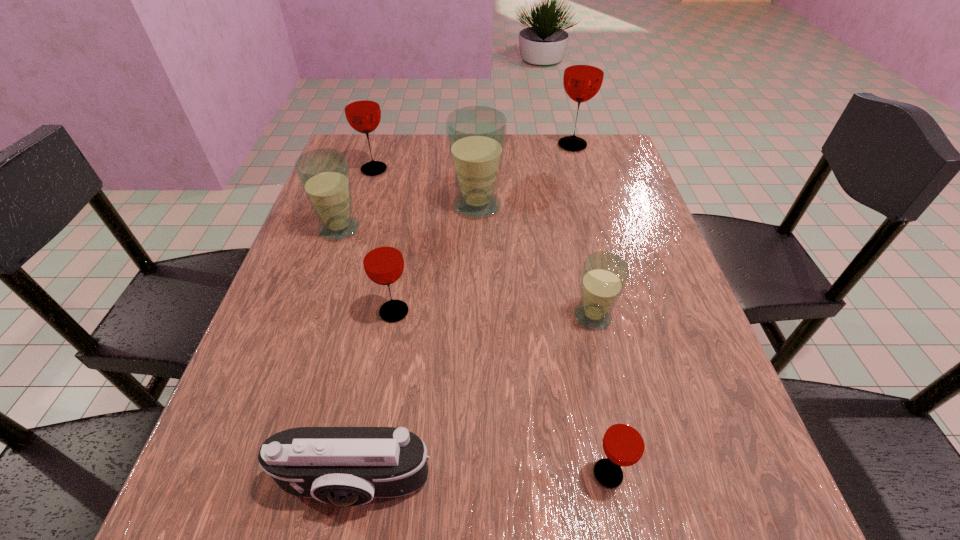
Locate which object is the seventh closest to the third nearest red glass. Please provide its 2D coordinates. Your answer should be formatted as a tuple, i.e. [(x, y)], where the tuple contains the x and y coordinates of a point satisfying the conditions above.

[(624, 442)]

Point out which glass is positioned as the sixth nearest to the third biggest red glass. Please provide its 2D coordinates. Your answer should be formatted as a tuple, i.e. [(x, y)], where the tuple contains the x and y coordinates of a point satisfying the conditions above.

[(583, 76)]

Identify the location of glass object that ranks as the closest to the fourth glass from right to left. The image size is (960, 540). (362, 110).

Find the location of a particular element. The width and height of the screenshot is (960, 540). red glass identified as the second closest to the biggest red glass is located at coordinates (383, 262).

Point out which red glass is positioned as the nearest to the biggest blue glass. Please provide its 2D coordinates. Your answer should be formatted as a tuple, i.e. [(x, y)], where the tuple contains the x and y coordinates of a point satisfying the conditions above.

[(362, 110)]

Locate an element on the screen. Image resolution: width=960 pixels, height=540 pixels. blue glass that is the closest one to the third glass from left to right is located at coordinates (324, 175).

Point out which blue glass is positioned as the nearest to the fifth glass from right to left. Please provide its 2D coordinates. Your answer should be formatted as a tuple, i.e. [(x, y)], where the tuple contains the x and y coordinates of a point satisfying the conditions above.

[(324, 175)]

This screenshot has width=960, height=540. Identify the location of vacant space that satisfies the following two spatial constraints: 1. on the back side of the biggest red glass; 2. on the right side of the nearest red glass. (543, 145).